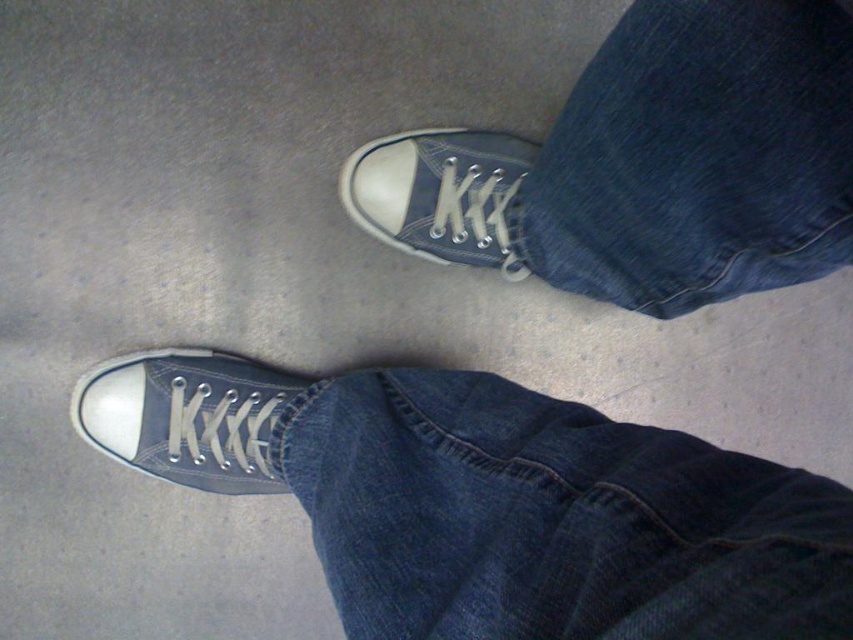
Question: Which point is closer to the camera?

Choices:
 (A) matte canvas shoe at center
 (B) denim at lower center

Answer: (B)

Question: Is denim at center smaller than matte canvas shoe at center?

Choices:
 (A) no
 (B) yes

Answer: (A)

Question: Which of the following is the farthest from the observer?

Choices:
 (A) (653, 131)
 (B) (827, 504)

Answer: (A)

Question: Which of these objects is positioned farthest from the denim at center?

Choices:
 (A) matte canvas shoe at center
 (B) matte canvas sneaker at lower left

Answer: (B)

Question: From the image, what is the correct spatial relationship of denim at center in relation to matte canvas sneaker at lower left?

Choices:
 (A) left
 (B) right

Answer: (B)

Question: Is denim at lower center bigger than matte canvas sneaker at lower left?

Choices:
 (A) yes
 (B) no

Answer: (A)